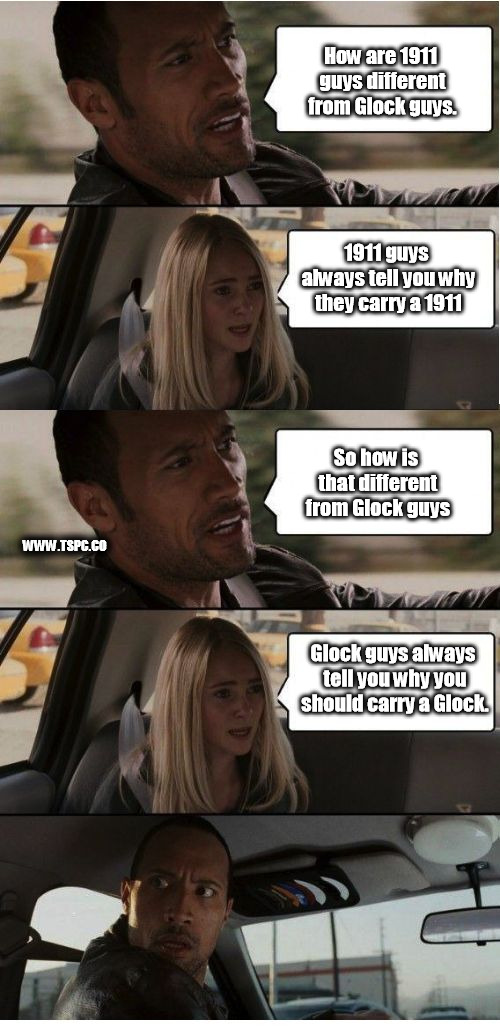
Locate an element on the screen. This screenshot has height=1026, width=500. frames is located at coordinates [171, 51], [179, 332], [204, 508], [208, 679], [215, 854].